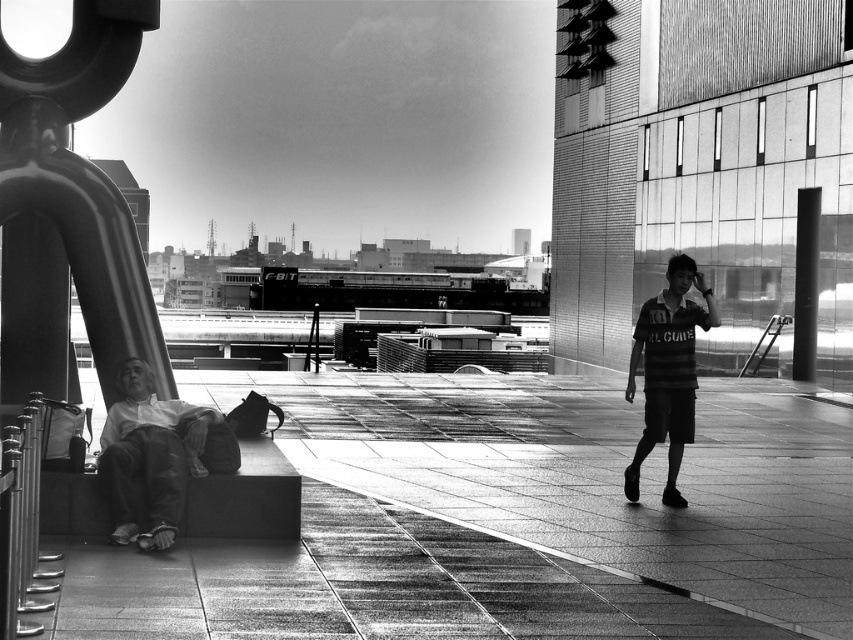
You are standing in the urban scene and want to walk from point (704, 419) to point (218, 445). Which direction should you move relative to your current position?

You should move downward and to the right because point (218, 445) is lower and further to the right compared to point (704, 419).